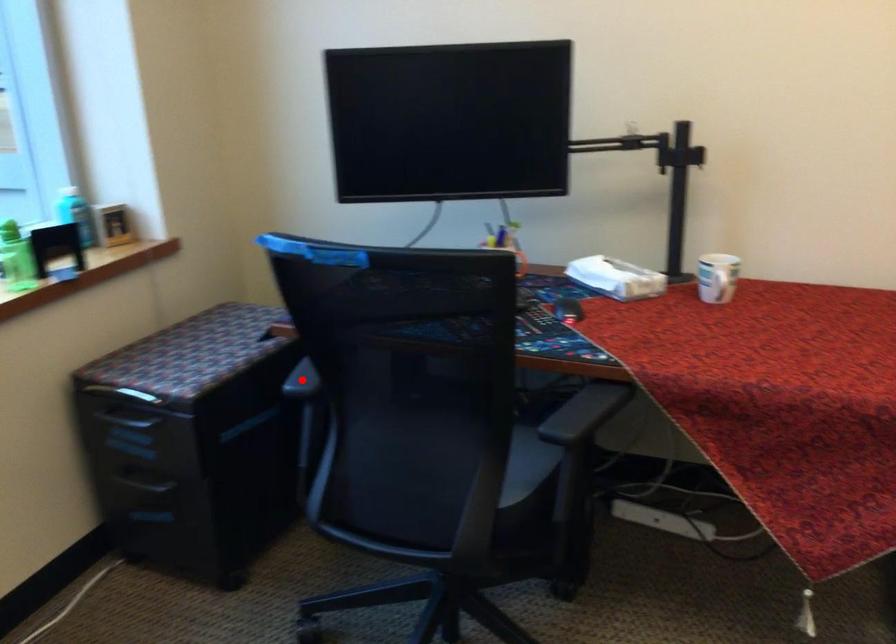
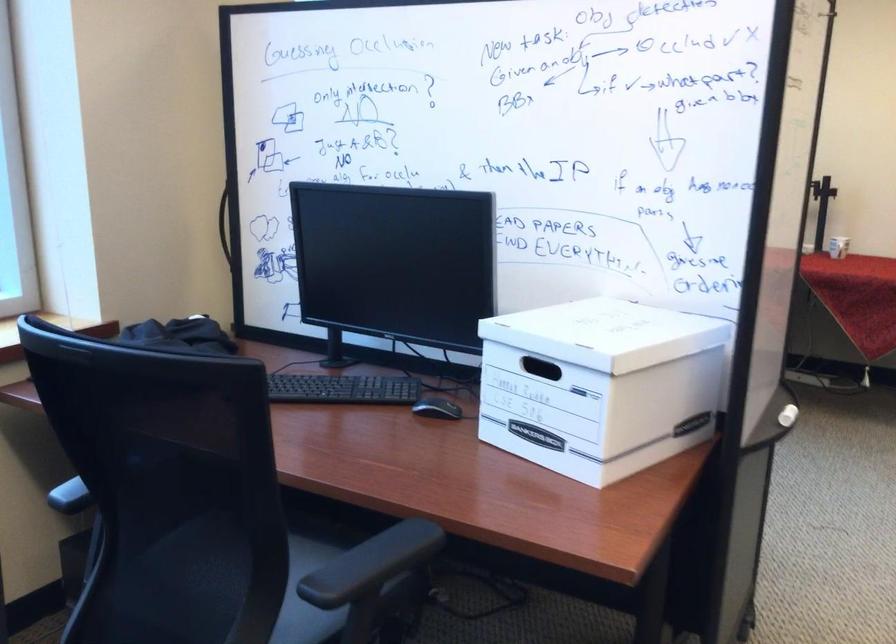
Question: I am providing you with two images of the same scene from different viewpoints. A red point is marked on the first image. At the location where the point appears in image 1, is it still visible in image 2?

Choices:
 (A) Yes
 (B) No

Answer: (B)